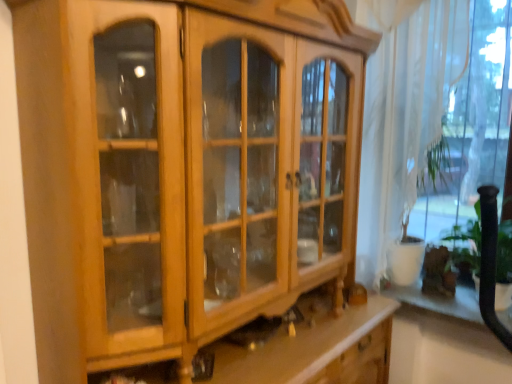
Question: In terms of height, does white glossy shelf at lower right look taller or shorter compared to white sheer curtain at right?

Choices:
 (A) short
 (B) tall

Answer: (A)

Question: Considering their positions, is white glossy shelf at lower right located in front of or behind white sheer curtain at right?

Choices:
 (A) behind
 (B) front

Answer: (A)

Question: Looking at their shapes, would you say white glossy shelf at lower right is wider or thinner than white sheer curtain at right?

Choices:
 (A) wide
 (B) thin

Answer: (A)

Question: In terms of size, does white sheer curtain at right appear bigger or smaller than white glossy shelf at lower right?

Choices:
 (A) big
 (B) small

Answer: (A)

Question: Is white sheer curtain at right taller or shorter than white glossy shelf at lower right?

Choices:
 (A) tall
 (B) short

Answer: (A)

Question: Considering the relative positions of white sheer curtain at right and white glossy shelf at lower right in the image provided, is white sheer curtain at right to the left or to the right of white glossy shelf at lower right?

Choices:
 (A) right
 (B) left

Answer: (B)

Question: Is white sheer curtain at right spatially inside white glossy shelf at lower right, or outside of it?

Choices:
 (A) inside
 (B) outside

Answer: (B)